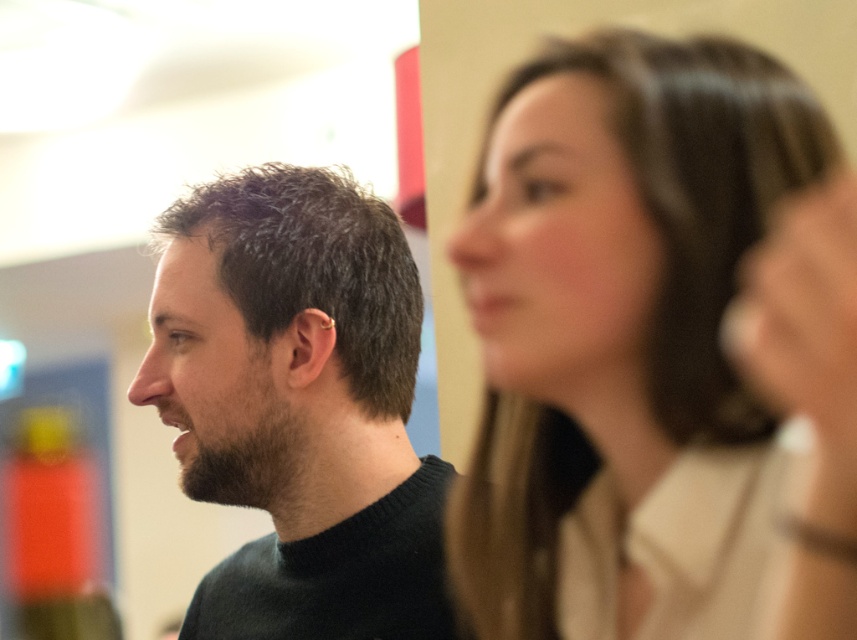
You are a photographer analyzing this image. You notice two points marked in the scene. The first point is at coordinates point [478,276] and the second is at point [381,538]. Based on the depth of field, which point is closer to the camera?

Point [478,276] is closer to the viewer than point [381,538], so the first point is closer to the camera.